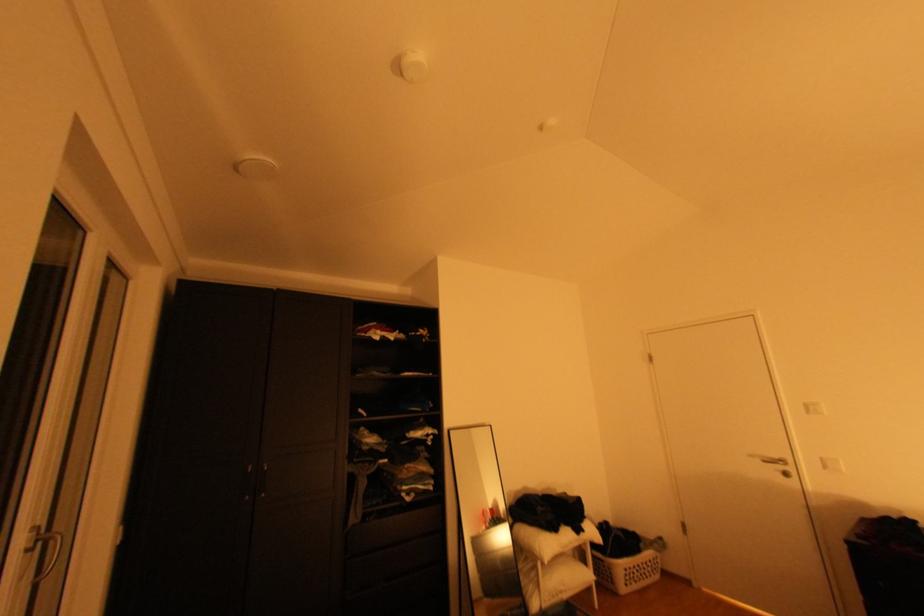
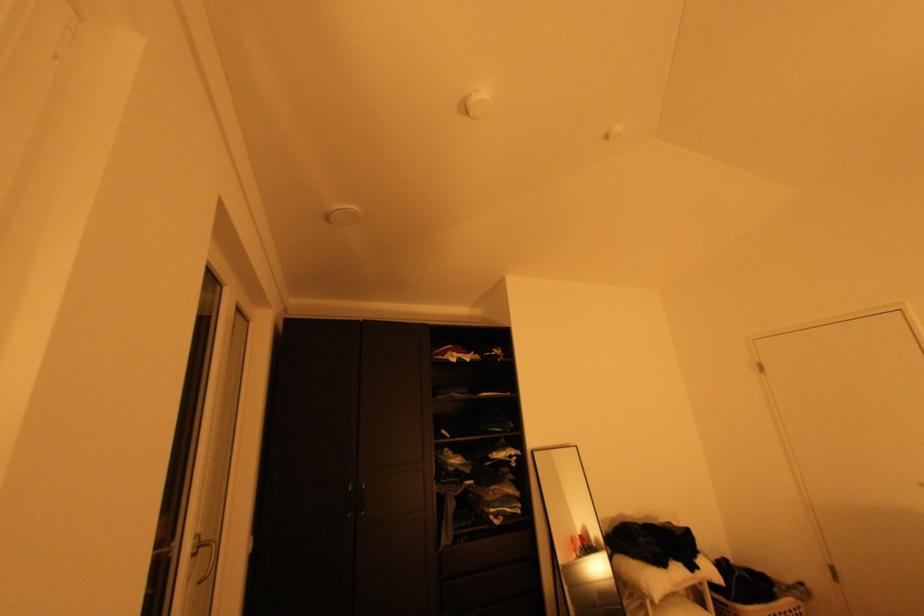
What movement of the cameraman would produce the second image?

The cameraman walked toward left, backward.